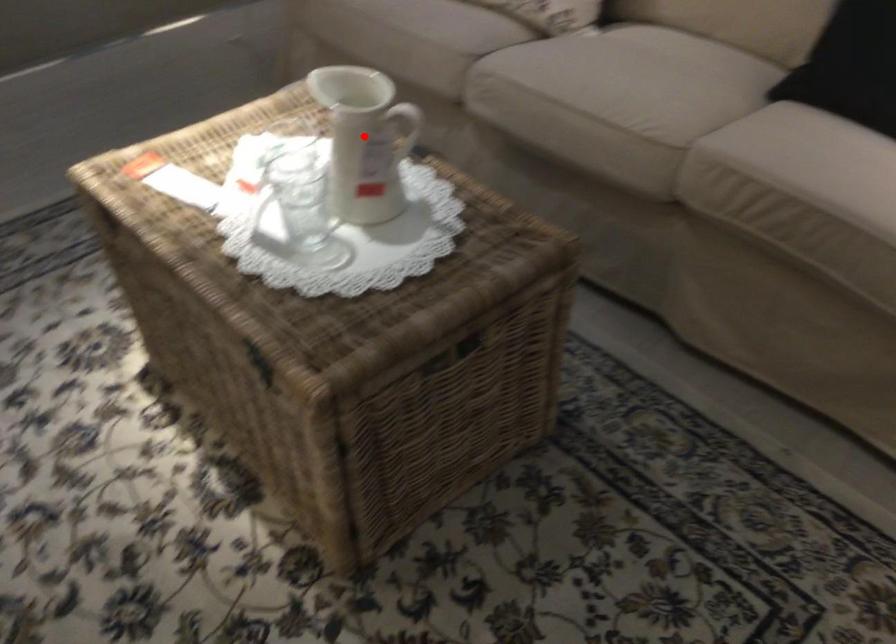
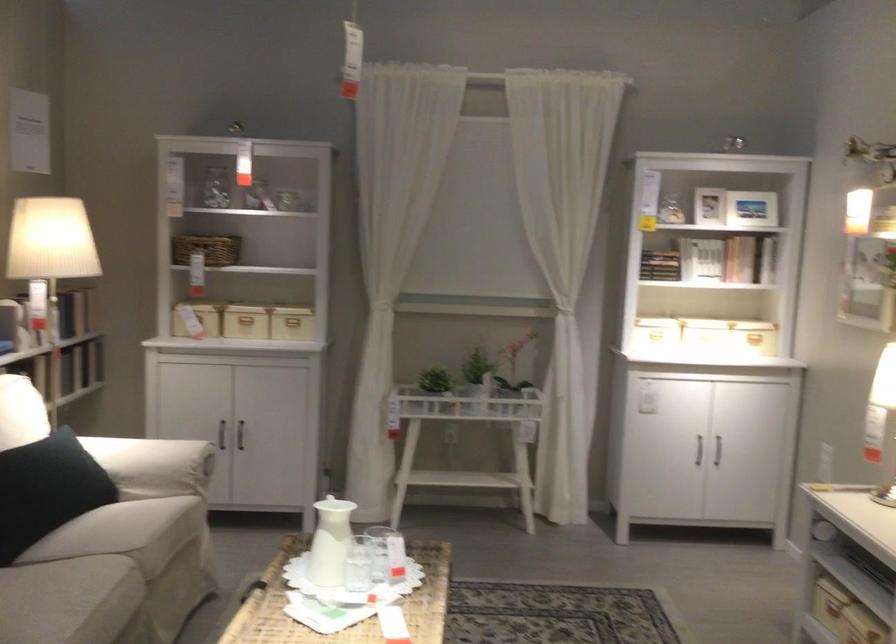
Question: I am providing you with two images of the same scene from different viewpoints. In image1, a red point is highlighted. Considering the same 3D point in image2, which of the following is correct?

Choices:
 (A) It is closer
 (B) It is farther

Answer: (B)